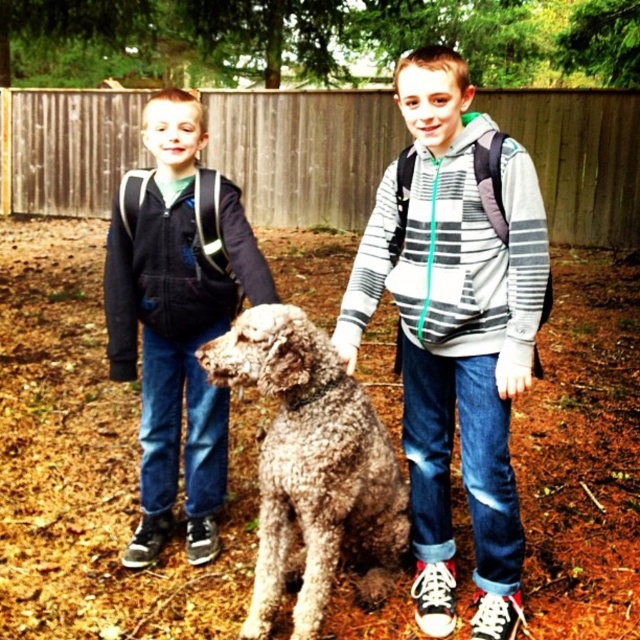
Question: Is striped hoodie at center thinner than fuzzy brown dog at center?

Choices:
 (A) no
 (B) yes

Answer: (B)

Question: Can you confirm if matte black hoodie at left is positioned to the right of fuzzy brown dog at center?

Choices:
 (A) no
 (B) yes

Answer: (A)

Question: Which point is farther from the camera taking this photo?

Choices:
 (A) click(321, 397)
 (B) click(337, 339)
 (C) click(168, 332)

Answer: (C)

Question: Among these points, which one is farthest from the camera?

Choices:
 (A) (296, 490)
 (B) (220, 220)

Answer: (B)

Question: Is striped hoodie at center smaller than matte black hoodie at left?

Choices:
 (A) yes
 (B) no

Answer: (A)

Question: Which object is farther from the camera taking this photo?

Choices:
 (A) matte black hoodie at left
 (B) fuzzy brown dog at center
 (C) striped hoodie at center

Answer: (A)